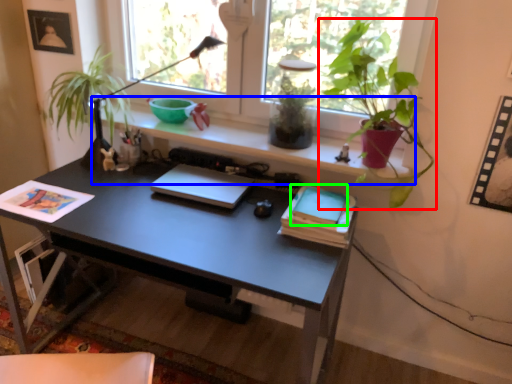
Question: Which is nearer to the houseplant (highlighted by a red box)? window sill (highlighted by a blue box) or paperback book (highlighted by a green box).

Choices:
 (A) window sill
 (B) paperback book

Answer: (A)